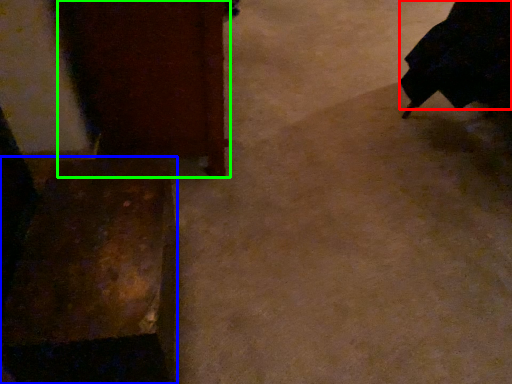
Question: Which object is positioned closest to robe (highlighted by a red box)? Select from furniture (highlighted by a blue box) and furniture (highlighted by a green box).

Choices:
 (A) furniture
 (B) furniture

Answer: (B)